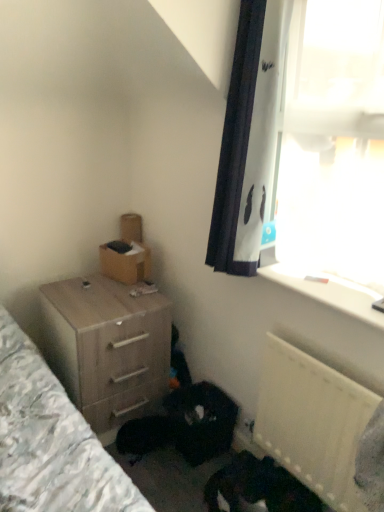
Locate an element on the screen. The image size is (384, 512). vacant space in front of brown cardboard box at upper left is located at coordinates (104, 287).